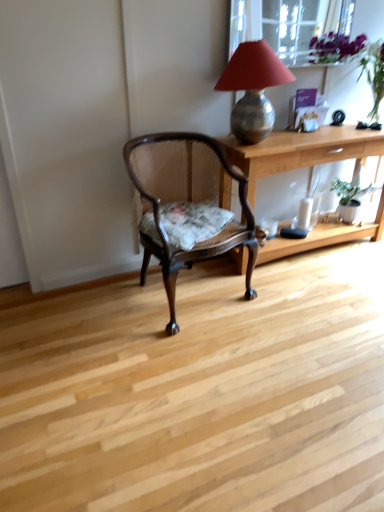
Question: Is green matte houseplant at right wider than light wood desk at center?

Choices:
 (A) yes
 (B) no

Answer: (B)

Question: Is green matte houseplant at right taller than light wood desk at center?

Choices:
 (A) no
 (B) yes

Answer: (A)

Question: Does green matte houseplant at right come behind light wood desk at center?

Choices:
 (A) yes
 (B) no

Answer: (A)

Question: Does green matte houseplant at right have a lesser height compared to light wood desk at center?

Choices:
 (A) no
 (B) yes

Answer: (B)

Question: Does green matte houseplant at right have a smaller size compared to light wood desk at center?

Choices:
 (A) no
 (B) yes

Answer: (B)

Question: Is green matte houseplant at right next to light wood desk at center and touching it?

Choices:
 (A) no
 (B) yes

Answer: (A)

Question: Is light wood desk at center aimed at metallic textured lamp at upper right?

Choices:
 (A) yes
 (B) no

Answer: (B)

Question: Does light wood desk at center have a larger size compared to metallic textured lamp at upper right?

Choices:
 (A) no
 (B) yes

Answer: (B)

Question: Is light wood desk at center located outside metallic textured lamp at upper right?

Choices:
 (A) no
 (B) yes

Answer: (B)

Question: From a real-world perspective, is light wood desk at center on top of metallic textured lamp at upper right?

Choices:
 (A) no
 (B) yes

Answer: (A)

Question: Considering the relative positions of light wood desk at center and metallic textured lamp at upper right in the image provided, is light wood desk at center behind metallic textured lamp at upper right?

Choices:
 (A) no
 (B) yes

Answer: (B)

Question: Is light wood desk at center shorter than metallic textured lamp at upper right?

Choices:
 (A) yes
 (B) no

Answer: (B)

Question: Would you say mahogany cane chair at center is a long distance from transparent glass window screen at upper center?

Choices:
 (A) yes
 (B) no

Answer: (A)